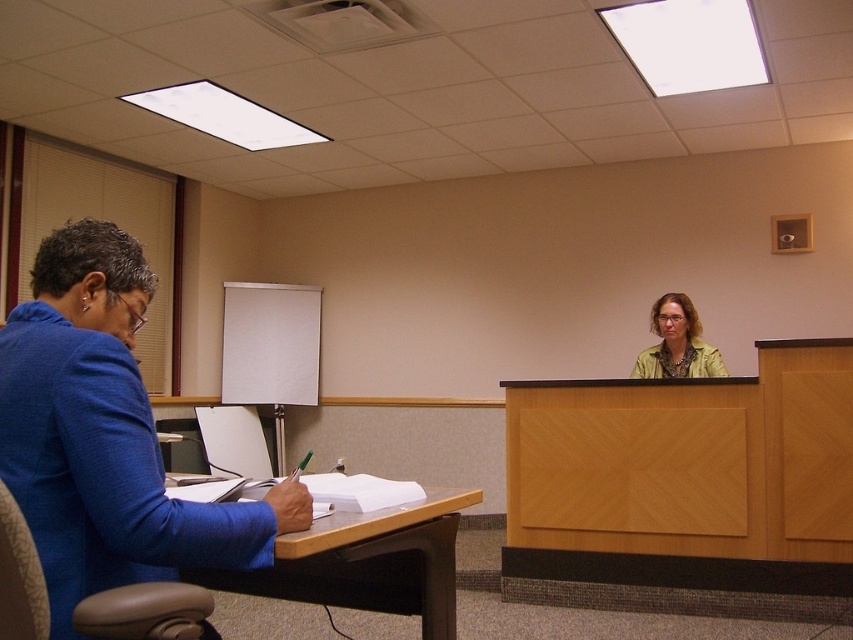
Question: Which of the following is the farthest from the observer?

Choices:
 (A) yellow-green textured blouse at upper right
 (B) wooden at left

Answer: (A)

Question: Can you confirm if blue fabric jacket at left is positioned above beige fabric swivel chair at lower left?

Choices:
 (A) yes
 (B) no

Answer: (A)

Question: Does wooden at left appear on the left side of beige fabric swivel chair at lower left?

Choices:
 (A) no
 (B) yes

Answer: (A)

Question: In this image, where is blue fabric jacket at left located relative to beige fabric swivel chair at lower left?

Choices:
 (A) right
 (B) left

Answer: (B)

Question: Based on their relative distances, which object is nearer to the beige fabric swivel chair at lower left?

Choices:
 (A) yellow-green textured blouse at upper right
 (B) wooden at left

Answer: (B)

Question: Estimate the real-world distances between objects in this image. Which object is farther from the yellow-green textured blouse at upper right?

Choices:
 (A) wooden at left
 (B) blue fabric jacket at left

Answer: (B)